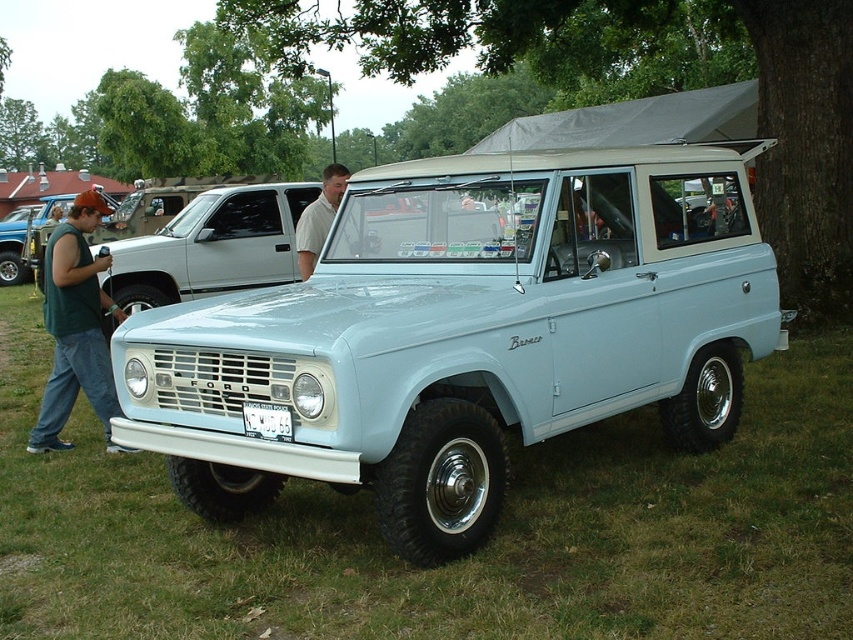
You are planning to park your car in a parking spot that can only accommodate vehicles up to the width of the matte black truck at left. Can the light blue matte bronco at center fit into this parking spot?

The light blue matte bronco at center is narrower than the matte black truck at left, so it will fit in the parking spot designed for the matte black truck at left.

You are a photographer trying to capture both the light blue matte bronco at center and the green sleeveless shirt at left in a single frame. Since the shirt is smaller, do you need to adjust your camera angle to include both subjects?

The light blue matte bronco at center is larger in size than the green sleeveless shirt at left, so you should zoom out slightly to ensure both subjects fit in the frame.